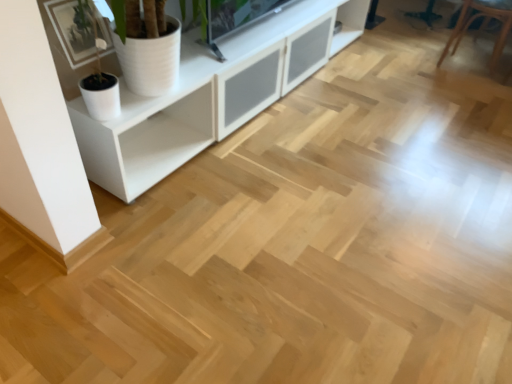
The height and width of the screenshot is (384, 512). Describe the element at coordinates (484, 23) in the screenshot. I see `brown leather armchair at upper right` at that location.

Locate an element on the screen. The image size is (512, 384). white matte cabinet at upper left is located at coordinates (210, 95).

Identify the location of brown leather armchair at upper right. (484, 23).

Which is correct: brown leather armchair at upper right is inside white matte pot at upper left, or outside of it?

The correct answer is: outside.

Which is in front, point (478, 12) or point (120, 113)?

The point (120, 113) is closer.

Locate an element on the screen. The width and height of the screenshot is (512, 384). houseplant on the left of brown leather armchair at upper right is located at coordinates (100, 82).

Is brown leather armchair at upper right to the left of white matte pot at upper left from the viewer's perspective?

Incorrect, brown leather armchair at upper right is not on the left side of white matte pot at upper left.

Is white matte cabinet at upper left with brown leather armchair at upper right?

No, white matte cabinet at upper left is not making contact with brown leather armchair at upper right.

The height and width of the screenshot is (384, 512). In order to click on armchair on the right of white matte cabinet at upper left in this screenshot , I will do `click(484, 23)`.

Can you tell me how much white matte cabinet at upper left and brown leather armchair at upper right differ in facing direction?

The angular difference between white matte cabinet at upper left and brown leather armchair at upper right is 4.55 degrees.

Relative to brown leather armchair at upper right, is white matte cabinet at upper left in front or behind?

white matte cabinet at upper left is positioned closer to the viewer than brown leather armchair at upper right.

Considering the points (120, 103) and (89, 173), which point is in front, point (120, 103) or point (89, 173)?

The point (120, 103) is in front.

Looking at this image, in the image, is white matte pot at upper left on the left side or the right side of white matte cabinet at upper left?

In the image, white matte pot at upper left appears on the left side of white matte cabinet at upper left.

Considering the sizes of white matte pot at upper left and white matte cabinet at upper left in the image, is white matte pot at upper left taller or shorter than white matte cabinet at upper left?

white matte pot at upper left is shorter than white matte cabinet at upper left.

Does white matte pot at upper left have a greater width compared to white matte cabinet at upper left?

No, white matte pot at upper left is not wider than white matte cabinet at upper left.

In the scene shown: Is white matte pot at upper left to the left or to the right of brown leather armchair at upper right in the image?

Clearly, white matte pot at upper left is on the left of brown leather armchair at upper right in the image.

Is white matte pot at upper left further to camera compared to brown leather armchair at upper right?

No, white matte pot at upper left is closer to the viewer.

Would you say white matte pot at upper left is inside or outside brown leather armchair at upper right?

white matte pot at upper left cannot be found inside brown leather armchair at upper right.

Based on their sizes in the image, would you say white matte pot at upper left is bigger or smaller than brown leather armchair at upper right?

white matte pot at upper left is smaller than brown leather armchair at upper right.

Considering the positions of objects white matte cabinet at upper left and white matte pot at upper left in the image provided, who is in front, white matte cabinet at upper left or white matte pot at upper left?

white matte cabinet at upper left.

Is white matte cabinet at upper left aimed at white matte pot at upper left?

No, white matte cabinet at upper left does not turn towards white matte pot at upper left.

At what (x,y) coordinates should I click in order to perform the action: click on cabinetry located above the white matte pot at upper left (from the image's perspective). Please return your answer as a coordinate pair (x, y). The image size is (512, 384). Looking at the image, I should click on (210, 95).

Is white matte cabinet at upper left situated inside white matte pot at upper left or outside?

white matte cabinet at upper left is outside white matte pot at upper left.

Which object is more forward, brown leather armchair at upper right or white matte cabinet at upper left?

white matte cabinet at upper left is more forward.

Considering the sizes of brown leather armchair at upper right and white matte cabinet at upper left in the image, is brown leather armchair at upper right taller or shorter than white matte cabinet at upper left?

In the image, brown leather armchair at upper right appears to be shorter than white matte cabinet at upper left.

From the image's perspective, is brown leather armchair at upper right positioned above or below white matte cabinet at upper left?

Clearly, from the image's perspective, brown leather armchair at upper right is above white matte cabinet at upper left.

From a real-world perspective, between brown leather armchair at upper right and white matte cabinet at upper left, who is vertically lower?

brown leather armchair at upper right, from a real-world perspective.

At what (x,y) coordinates should I click in order to perform the action: click on armchair behind the white matte pot at upper left. Please return your answer as a coordinate pair (x, y). The image size is (512, 384). Looking at the image, I should click on (484, 23).

Find the location of `cabinetry lying below the brown leather armchair at upper right (from the image's perspective)`. cabinetry lying below the brown leather armchair at upper right (from the image's perspective) is located at coordinates (210, 95).

Considering their positions, is white matte cabinet at upper left positioned closer to brown leather armchair at upper right than white matte pot at upper left?

Among the two, white matte cabinet at upper left is located nearer to brown leather armchair at upper right.

Looking at the image, which one is located further to white matte pot at upper left, brown leather armchair at upper right or white matte cabinet at upper left?

brown leather armchair at upper right.

Based on their spatial positions, is brown leather armchair at upper right or white matte pot at upper left closer to white matte cabinet at upper left?

white matte pot at upper left is positioned closer to the anchor white matte cabinet at upper left.

Which object lies further to the anchor point brown leather armchair at upper right, white matte pot at upper left or white matte cabinet at upper left?

white matte pot at upper left lies further to brown leather armchair at upper right than the other object.

Looking at the image, which one is located further to white matte cabinet at upper left, white matte pot at upper left or brown leather armchair at upper right?

brown leather armchair at upper right lies further to white matte cabinet at upper left than the other object.

From the picture: Looking at the image, which one is located further to white matte pot at upper left, white matte cabinet at upper left or brown leather armchair at upper right?

Based on the image, brown leather armchair at upper right appears to be further to white matte pot at upper left.

Image resolution: width=512 pixels, height=384 pixels. Identify the location of cabinetry between white matte pot at upper left and brown leather armchair at upper right from left to right. (210, 95).